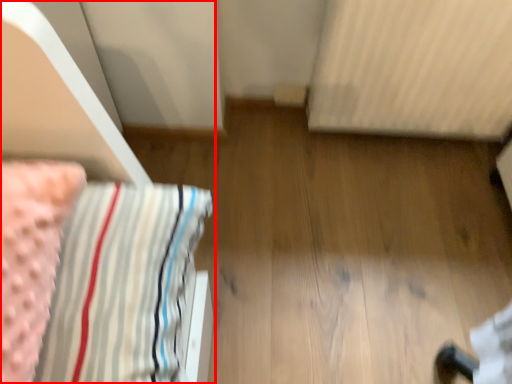
Question: Observing the image, what is the correct spatial positioning of furniture (annotated by the red box) in reference to radiator?

Choices:
 (A) left
 (B) right

Answer: (A)